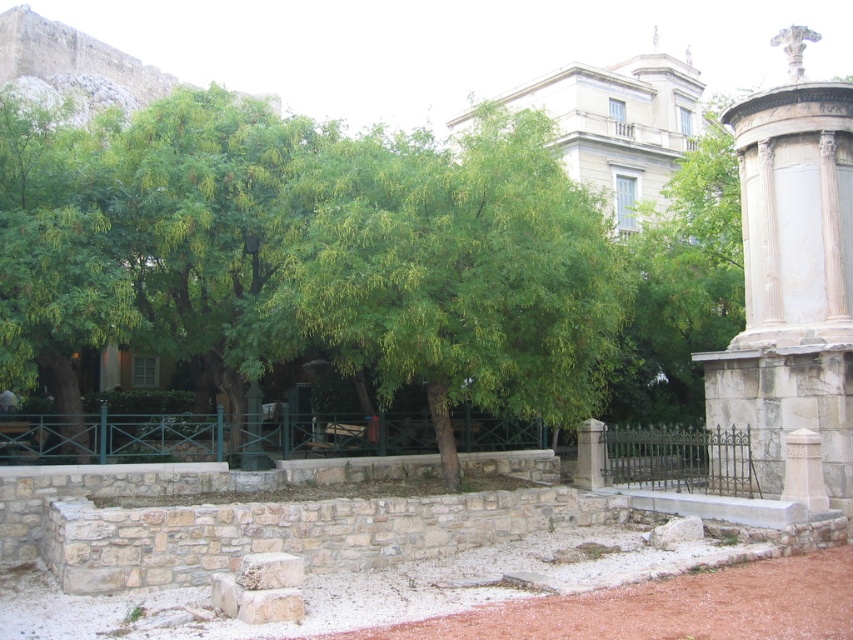
Who is positioned more to the right, white marble column at right or green leafy tree at left?

From the viewer's perspective, white marble column at right appears more on the right side.

Between point (828, 216) and point (62, 157), which one is positioned in front?

Point (62, 157)

You are a GUI agent. You are given a task and a screenshot of the screen. Output one action in this format:
    pyautogui.click(x=<x>, y=<y>)
    Task: Click on the white marble column at right
    The width and height of the screenshot is (853, 640).
    Given the screenshot: What is the action you would take?
    pyautogui.click(x=792, y=275)

Does point (396, 218) come closer to viewer compared to point (114, 292)?

That is True.

In the scene shown: Who is shorter, green leafy tree at center or green leafy tree at left?

With less height is green leafy tree at left.

I want to click on green leafy tree at center, so click(451, 269).

Can you confirm if green leafy tree at center is smaller than white marble column at right?

Actually, green leafy tree at center might be larger than white marble column at right.

Between green leafy tree at center and white marble column at right, which one is positioned higher?

green leafy tree at center is above.

You are a GUI agent. You are given a task and a screenshot of the screen. Output one action in this format:
    pyautogui.click(x=<x>, y=<y>)
    Task: Click on the green leafy tree at center
    The width and height of the screenshot is (853, 640).
    Given the screenshot: What is the action you would take?
    pyautogui.click(x=451, y=269)